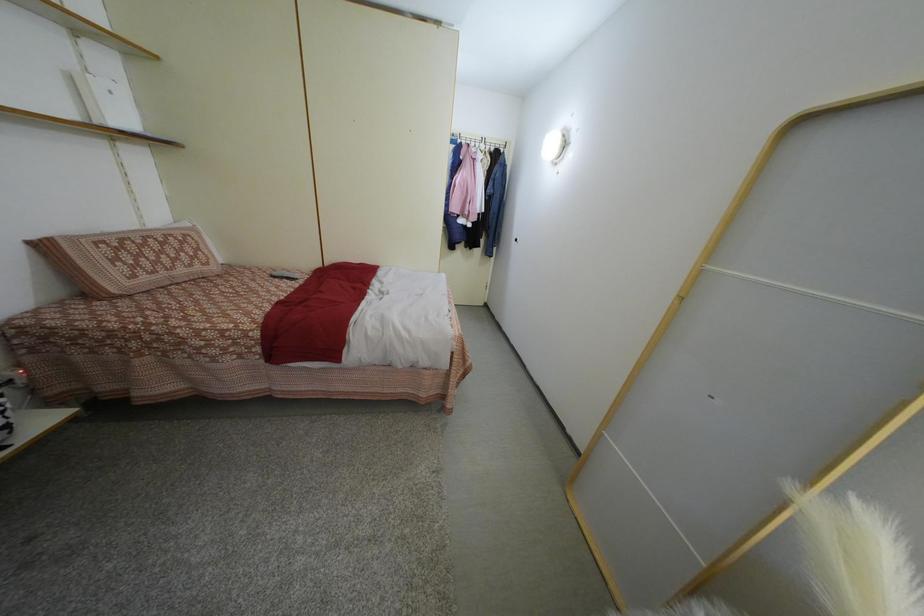
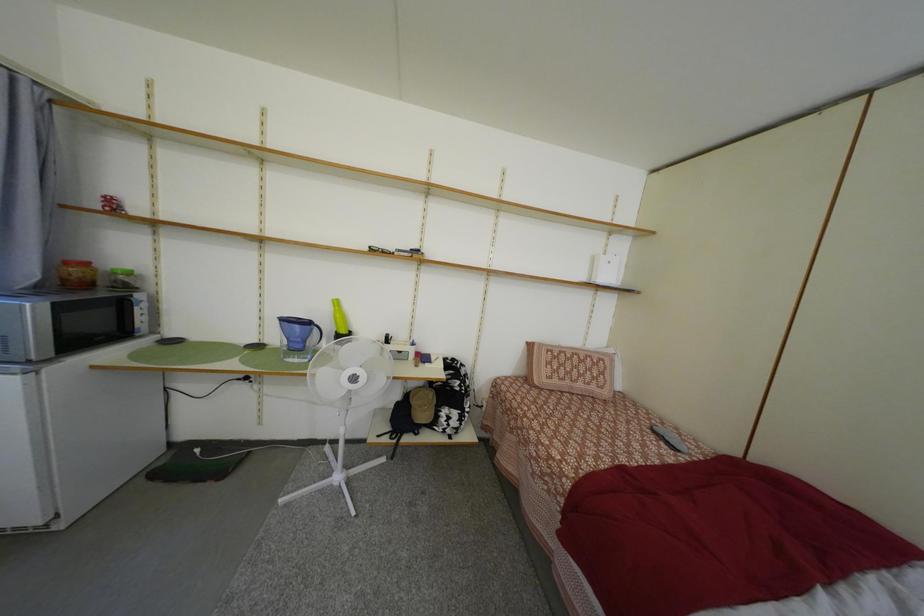
Question: The images are taken continuously from a first-person perspective. In which direction is your viewpoint rotating?

Choices:
 (A) Left
 (B) Right
 (C) Up
 (D) Down

Answer: (A)